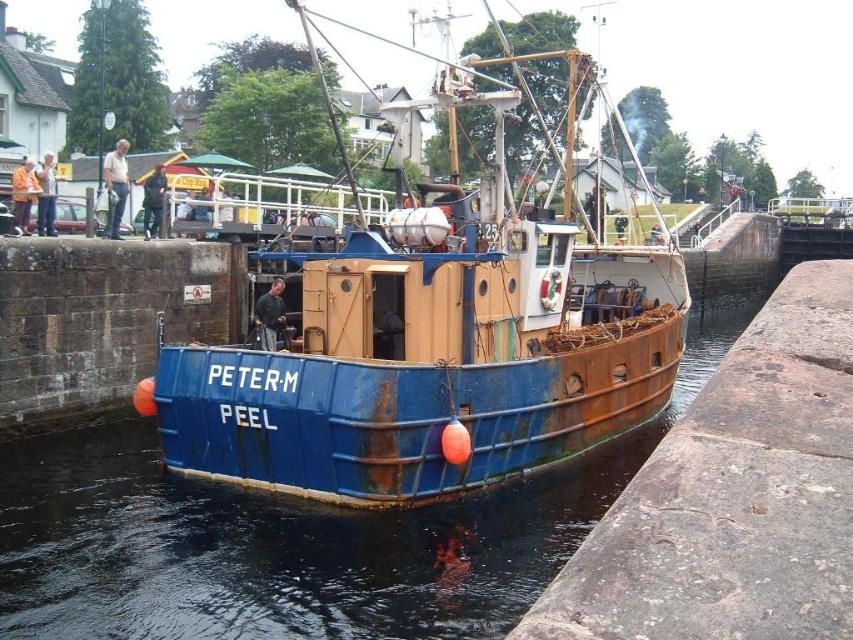
Looking at this image, can you confirm if rusty metal boat at center is positioned to the right of rusty metal water at center?

No, rusty metal boat at center is not to the right of rusty metal water at center.

Between point (340, 280) and point (18, 602), which one is positioned behind?

Point (340, 280)

The image size is (853, 640). What do you see at coordinates (433, 348) in the screenshot?
I see `rusty metal boat at center` at bounding box center [433, 348].

Find the location of a particular element. The width and height of the screenshot is (853, 640). rusty metal boat at center is located at coordinates (433, 348).